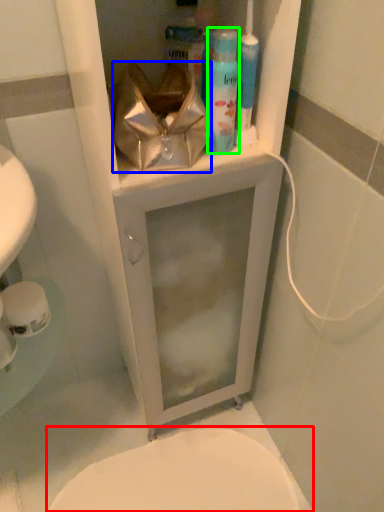
Question: Which is nearer to the bidet (highlighted by a red box)? pouch (highlighted by a blue box) or shaving cream (highlighted by a green box).

Choices:
 (A) pouch
 (B) shaving cream

Answer: (A)